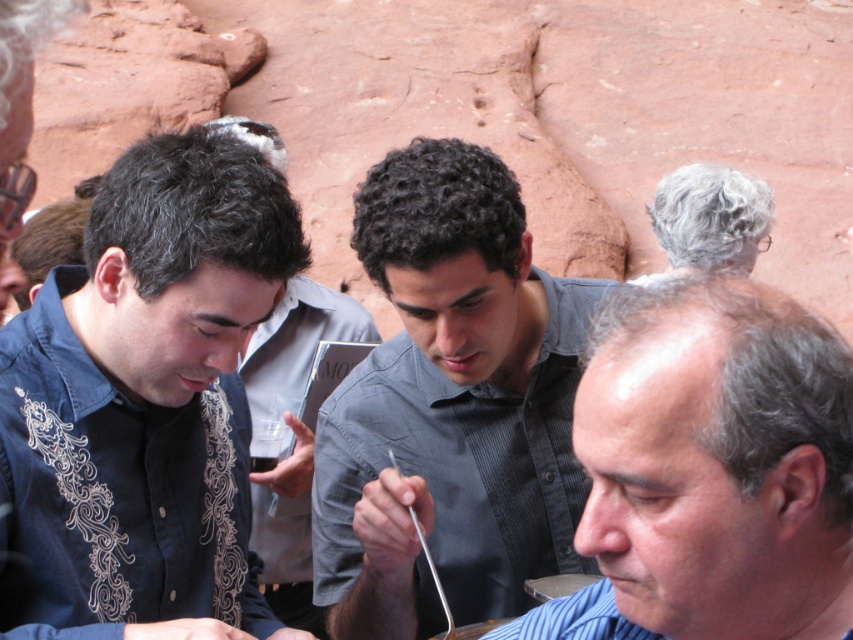
Does dark blue denim shirt at left have a smaller size compared to dark blue shirt at center?

No, dark blue denim shirt at left is not smaller than dark blue shirt at center.

Where is `dark blue denim shirt at left`? The height and width of the screenshot is (640, 853). dark blue denim shirt at left is located at coordinates (144, 396).

Between gray striped shirt at center and dark blue shirt at center, which one is positioned lower?

gray striped shirt at center is lower down.

Does gray striped shirt at center have a smaller size compared to dark blue shirt at center?

Correct, gray striped shirt at center occupies less space than dark blue shirt at center.

Image resolution: width=853 pixels, height=640 pixels. What do you see at coordinates (711, 468) in the screenshot?
I see `gray striped shirt at center` at bounding box center [711, 468].

Find the location of `gray striped shirt at center`. gray striped shirt at center is located at coordinates (711, 468).

Can you confirm if gray striped shirt at center is taller than gray curly hair at upper center?

Incorrect, gray striped shirt at center's height is not larger of gray curly hair at upper center's.

Is gray striped shirt at center positioned in front of gray curly hair at upper center?

Yes, it is.

Which is behind, point (828, 458) or point (720, 221)?

Point (720, 221)

The image size is (853, 640). What are the coordinates of `gray striped shirt at center` in the screenshot? It's located at (711, 468).